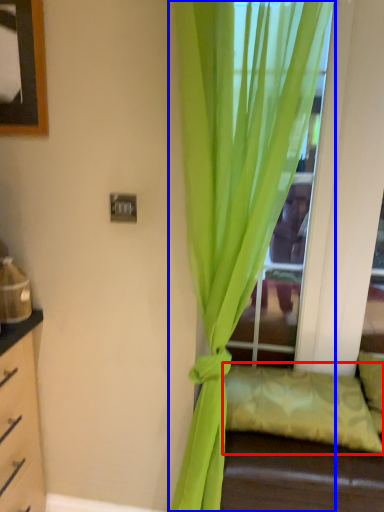
Question: Which point is closer to the camera, pillow (highlighted by a red box) or curtain (highlighted by a blue box)?

Choices:
 (A) pillow
 (B) curtain

Answer: (B)